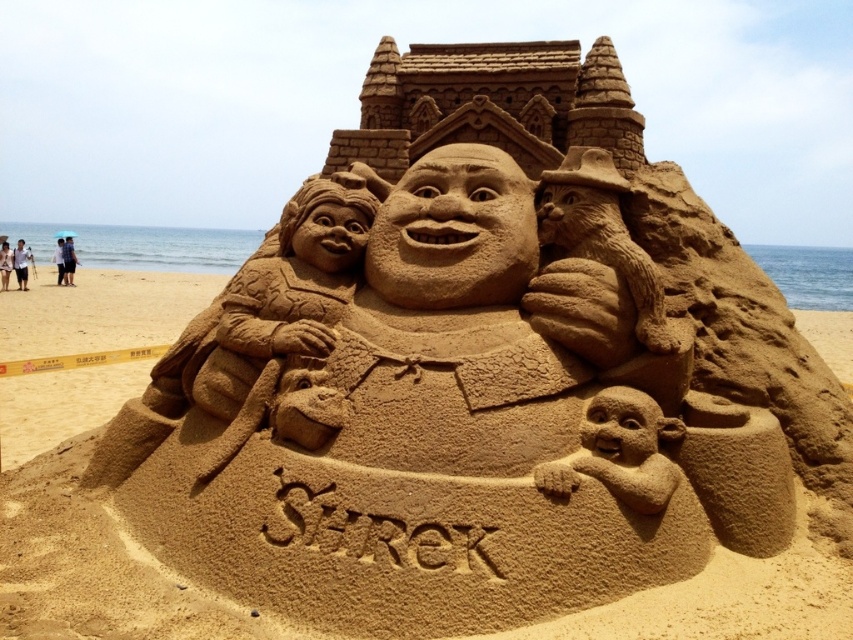
Question: Which object is positioned closest to the smooth sand monkey at lower center?

Choices:
 (A) beige sand sculpture at center
 (B) dark blue fabric umbrella at upper left
 (C) white shirt at left
 (D) white cotton umbrella at upper left

Answer: (C)

Question: Does smooth sand monkey at lower center come behind white shirt at left?

Choices:
 (A) yes
 (B) no

Answer: (B)

Question: Which point is farther to the camera?

Choices:
 (A) (68, 284)
 (B) (616, 449)
 (C) (25, 257)
 (D) (38, 342)

Answer: (C)

Question: Does dark blue fabric umbrella at upper left have a smaller size compared to white cotton umbrella at upper left?

Choices:
 (A) no
 (B) yes

Answer: (A)

Question: Which object is the closest to the white cotton umbrella at upper left?

Choices:
 (A) smooth sand sculpture at center
 (B) dark blue fabric umbrella at upper left

Answer: (B)

Question: Does smooth sand monkey at lower center have a lesser width compared to white shirt at left?

Choices:
 (A) no
 (B) yes

Answer: (B)